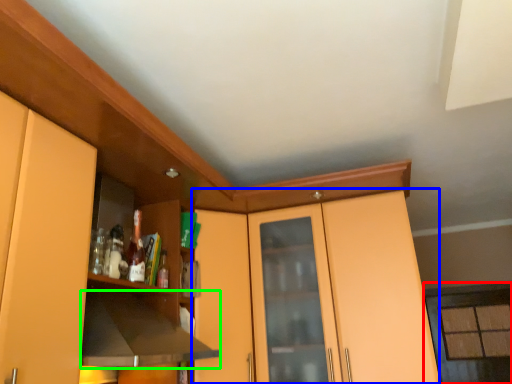
Question: Estimate the real-world distances between objects in this image. Which object is closer to window (highlighted by a red box), dresser (highlighted by a blue box) or exhaust hood (highlighted by a green box)?

Choices:
 (A) dresser
 (B) exhaust hood

Answer: (A)